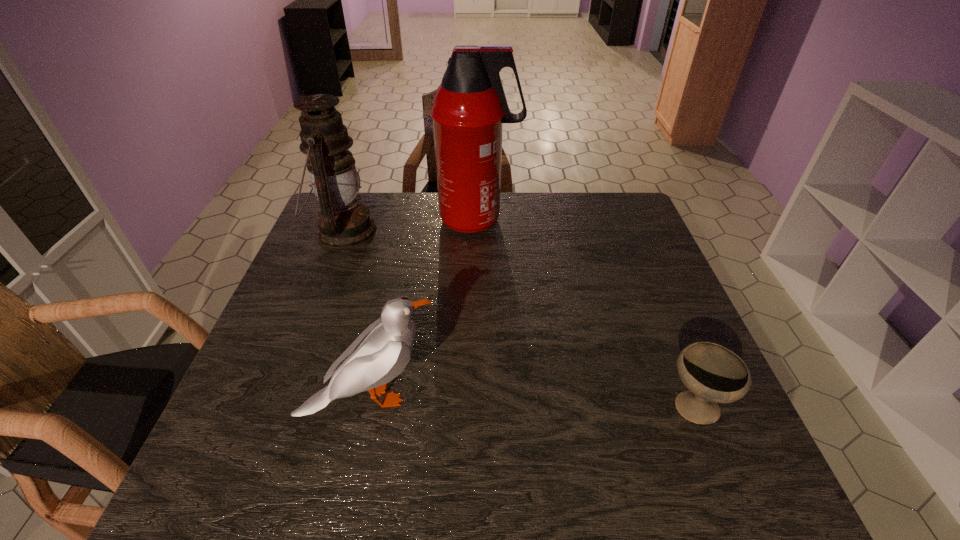
Find the location of a particular element. lantern present at the far edge is located at coordinates (343, 223).

You are a GUI agent. You are given a task and a screenshot of the screen. Output one action in this format:
    pyautogui.click(x=<x>, y=<y>)
    Task: Click on the lantern present at the left edge
    The image size is (960, 540).
    Given the screenshot: What is the action you would take?
    pyautogui.click(x=343, y=223)

The width and height of the screenshot is (960, 540). Identify the location of gull that is positioned at the left edge. (381, 352).

Where is `object present at the right edge`? This screenshot has height=540, width=960. object present at the right edge is located at coordinates (713, 374).

This screenshot has width=960, height=540. Find the location of `object located in the far left corner section of the desktop`. object located in the far left corner section of the desktop is located at coordinates (343, 223).

Identify the location of vacant space at the far edge. This screenshot has width=960, height=540. (431, 206).

Find the location of a particular element. blank space at the near edge of the desktop is located at coordinates (500, 479).

Identify the location of vacant space at the left edge of the desktop. (290, 451).

You are a GUI agent. You are given a task and a screenshot of the screen. Output one action in this format:
    pyautogui.click(x=<x>, y=<y>)
    Task: Click on the vacant region at the right edge of the desktop
    This screenshot has width=960, height=540.
    Given the screenshot: What is the action you would take?
    pyautogui.click(x=627, y=303)

In the image, there is a desktop. Where is `blank space at the far right corner`? This screenshot has width=960, height=540. blank space at the far right corner is located at coordinates (610, 205).